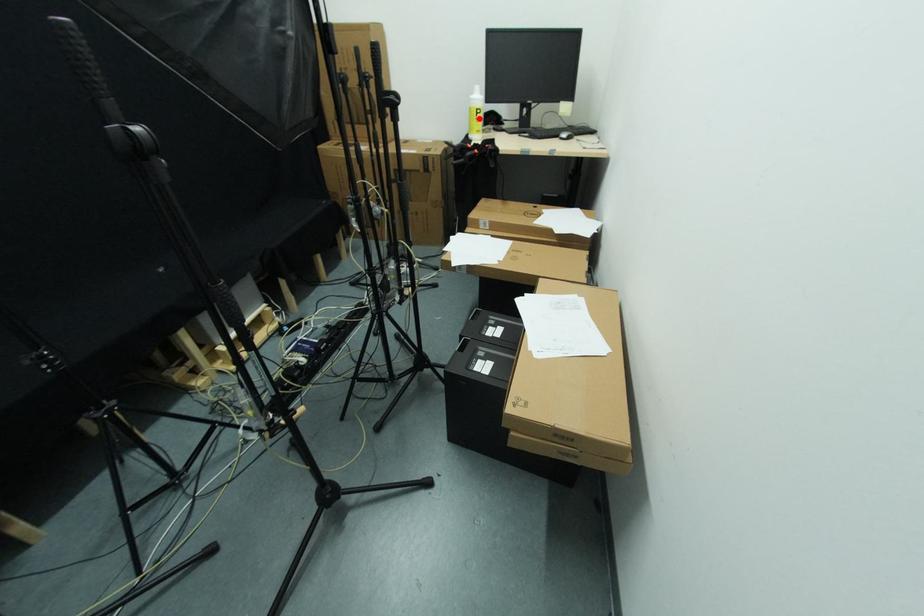
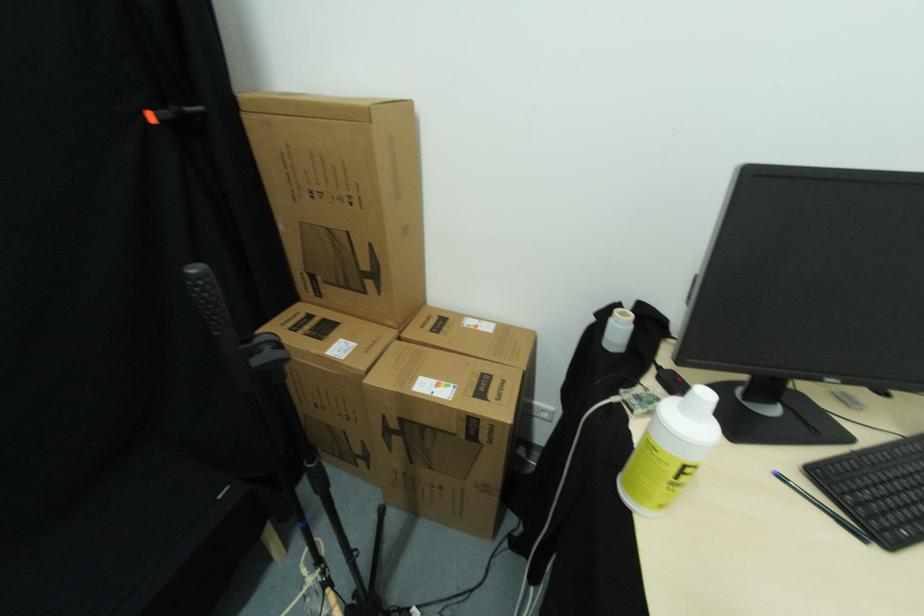
In the second image, find the point that corresponds to the highlighted location in the first image.

(678, 480)